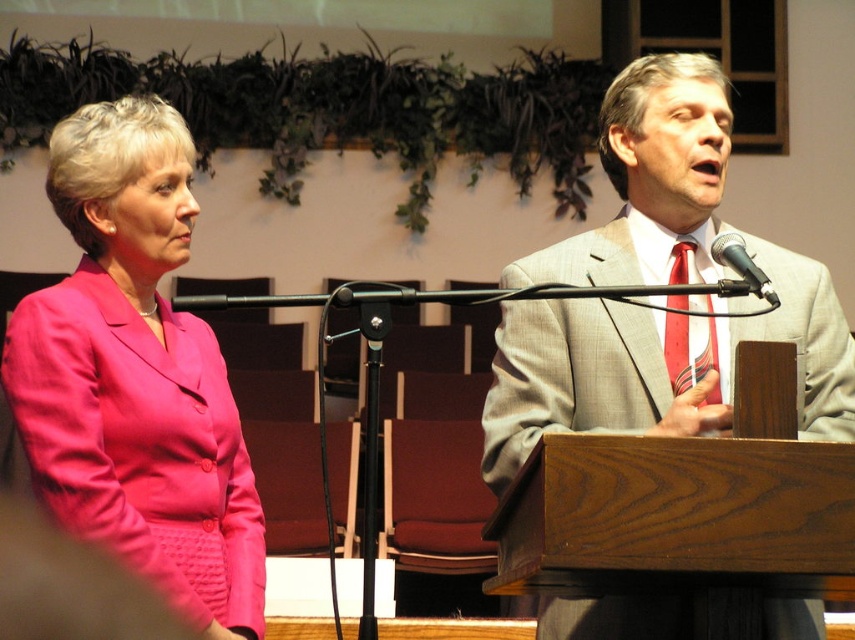
You are a photographer at the event and need to capture a closeup shot of both the striped silk tie at right and the black metallic microphone at upper right. Since your camera can only focus on one object at a time, which object should you focus on first to ensure it appears larger in the photo?

The striped silk tie at right is bigger than the black metallic microphone at upper right, so you should focus on the striped silk tie at right first to ensure it appears larger in the photo.